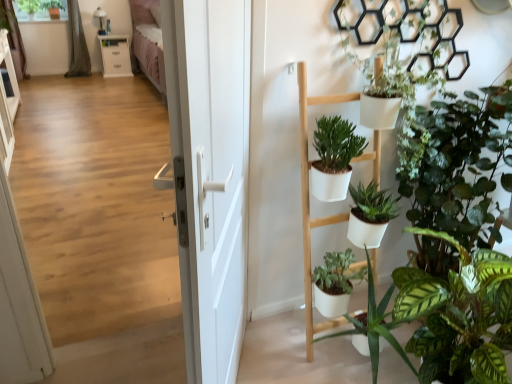
This screenshot has width=512, height=384. In order to click on vacant space to the left of wooden floor at center in this screenshot , I will do `click(83, 322)`.